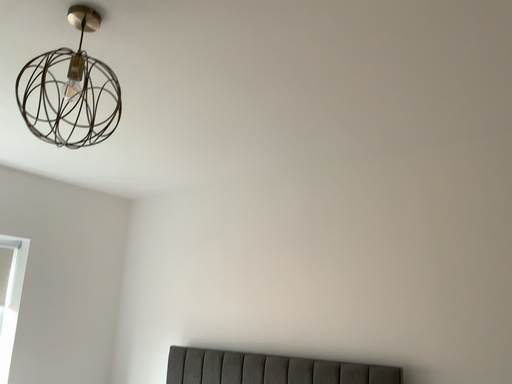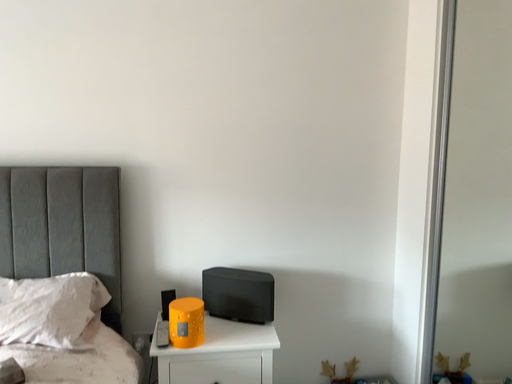
Question: How did the camera likely rotate when shooting the video?

Choices:
 (A) rotated left
 (B) rotated right

Answer: (B)